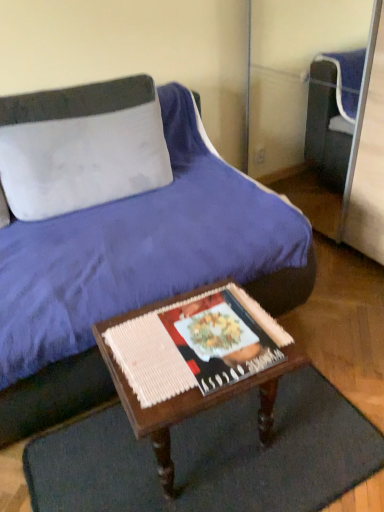
Where is `free area in between velvet blue bed at center and dark brown woven mat at lower center`? free area in between velvet blue bed at center and dark brown woven mat at lower center is located at coordinates (317, 366).